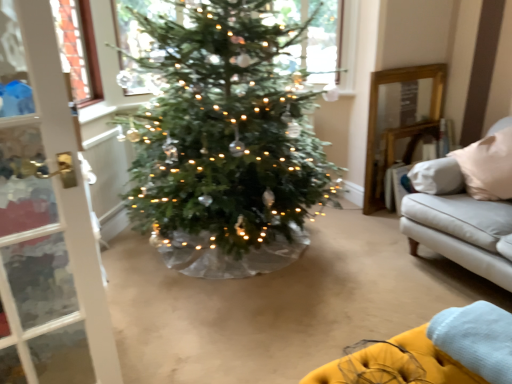
Question: Is velvet yellow couch at lower right positioned beyond the bounds of clear glass window at upper center?

Choices:
 (A) no
 (B) yes

Answer: (B)

Question: From the image's perspective, is velvet yellow couch at lower right below clear glass window at upper center?

Choices:
 (A) no
 (B) yes

Answer: (B)

Question: Is velvet yellow couch at lower right thinner than clear glass window at upper center?

Choices:
 (A) yes
 (B) no

Answer: (B)

Question: Can you confirm if velvet yellow couch at lower right is bigger than clear glass window at upper center?

Choices:
 (A) no
 (B) yes

Answer: (B)

Question: From a real-world perspective, is velvet yellow couch at lower right on clear glass window at upper center?

Choices:
 (A) no
 (B) yes

Answer: (A)

Question: Considering the relative positions of velvet yellow couch at lower right and clear glass window at upper center in the image provided, is velvet yellow couch at lower right to the right of clear glass window at upper center from the viewer's perspective?

Choices:
 (A) yes
 (B) no

Answer: (A)

Question: From a real-world perspective, is yellow fabric blanket at lower right positioned under velvet yellow couch at lower right based on gravity?

Choices:
 (A) no
 (B) yes

Answer: (A)

Question: Is yellow fabric blanket at lower right closer to the viewer compared to velvet yellow couch at lower right?

Choices:
 (A) no
 (B) yes

Answer: (A)

Question: Can you confirm if yellow fabric blanket at lower right is wider than velvet yellow couch at lower right?

Choices:
 (A) yes
 (B) no

Answer: (B)

Question: Is yellow fabric blanket at lower right smaller than velvet yellow couch at lower right?

Choices:
 (A) no
 (B) yes

Answer: (B)

Question: Does yellow fabric blanket at lower right have a lesser height compared to velvet yellow couch at lower right?

Choices:
 (A) no
 (B) yes

Answer: (B)

Question: Is yellow fabric blanket at lower right bigger than velvet yellow couch at lower right?

Choices:
 (A) yes
 (B) no

Answer: (B)

Question: From the image's perspective, is clear glass window at upper center above velvet yellow couch at lower right?

Choices:
 (A) yes
 (B) no

Answer: (A)